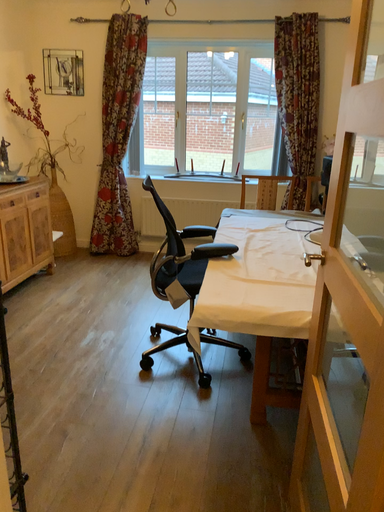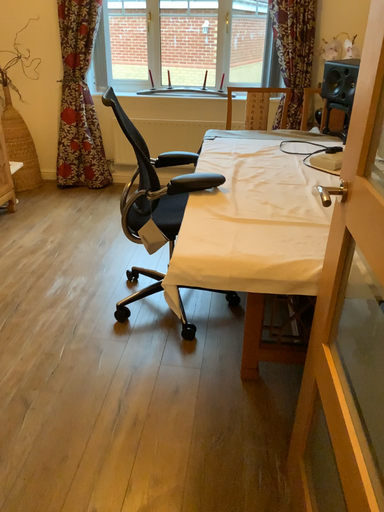
Question: How did the camera likely rotate when shooting the video?

Choices:
 (A) rotated downward
 (B) rotated upward

Answer: (A)